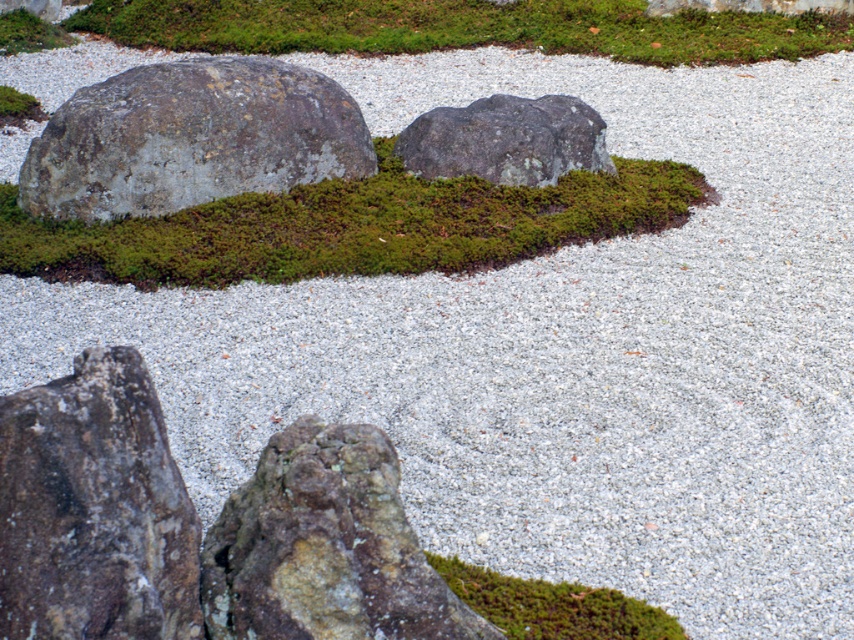
Does rusty metallic rock at lower left have a lesser height compared to green moss at center?

No, rusty metallic rock at lower left is not shorter than green moss at center.

Between point (106, 353) and point (490, 573), which one is positioned behind?

Point (490, 573)

Measure the distance between point (145,394) and camera.

Point (145,394) is 12.71 feet away from camera.

Identify the location of rusty metallic rock at lower left. (94, 509).

Looking at this image, between green mossy rock at lower left and green moss at upper center, which one is positioned lower?

green mossy rock at lower left is lower down.

Between green mossy rock at lower left and green moss at upper center, which one has less height?

With less height is green mossy rock at lower left.

Between point (410, 636) and point (539, 33), which one is positioned behind?

Positioned behind is point (539, 33).

Identify the location of green mossy rock at lower left. (325, 547).

Is rough gray rock at center positioned behind green moss at center?

Yes, it is behind green moss at center.

Can you confirm if rough gray rock at center is shorter than green moss at center?

No.

Is point (576, 118) positioned before point (496, 612)?

No.

Where is `rough gray rock at center`? This screenshot has height=640, width=854. rough gray rock at center is located at coordinates (506, 140).